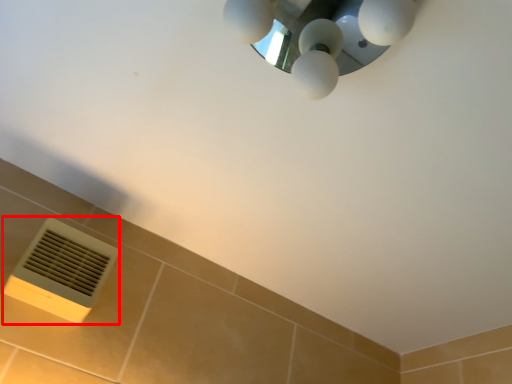
Question: From the image's perspective, where is air conditioning (annotated by the red box) located in relation to lamp in the image?

Choices:
 (A) below
 (B) above

Answer: (A)